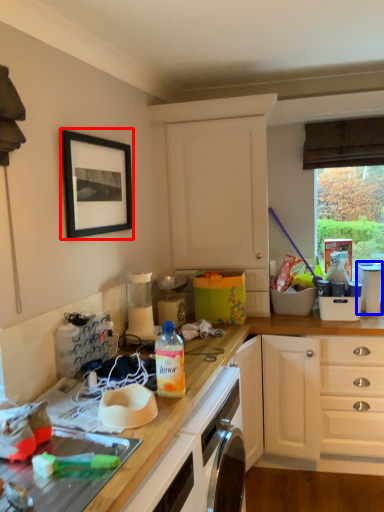
Question: Among these objects, which one is nearest to the camera, picture frame (highlighted by a red box) or appliance (highlighted by a blue box)?

Choices:
 (A) picture frame
 (B) appliance

Answer: (A)